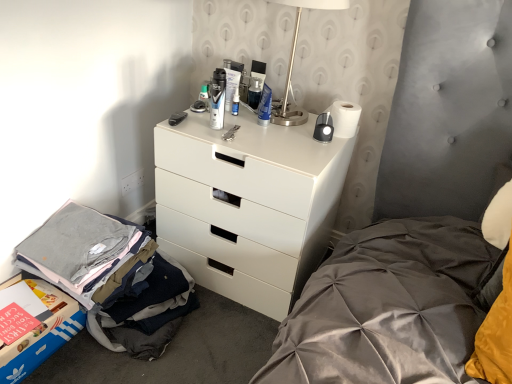
This screenshot has width=512, height=384. Describe the element at coordinates (345, 118) in the screenshot. I see `white matte toilet paper at upper right` at that location.

What do you see at coordinates (111, 277) in the screenshot? I see `gray cotton t-shirts at lower left` at bounding box center [111, 277].

I want to click on gray cotton t-shirts at lower left, so click(111, 277).

What is the approximate height of white plastic outlet at lower left?

white plastic outlet at lower left is 4.12 inches in height.

The width and height of the screenshot is (512, 384). Find the location of `matte plastic tube at upper center, marked as the 3th toiletry in a right-to-left arrangement`. matte plastic tube at upper center, marked as the 3th toiletry in a right-to-left arrangement is located at coordinates (231, 80).

The width and height of the screenshot is (512, 384). I want to click on blue plastic tube at center, which is the 1th toiletry from right to left, so click(x=265, y=106).

Describe the element at coordinates (265, 106) in the screenshot. I see `blue plastic tube at center, which is the 1th toiletry from right to left` at that location.

Find the location of a particular element. This screenshot has width=512, height=384. white matte toilet paper at upper right is located at coordinates (345, 118).

Which point is more distant from viewer, [73,302] or [166,251]?

The point [166,251] is behind.

Consider the image. Is blue cardboard storage box at lower left far from white matte chest of drawers at center?

They are positioned close to each other.

From a real-world perspective, is blue cardboard storage box at lower left positioned under white matte chest of drawers at center based on gravity?

Yes, from a real-world perspective, blue cardboard storage box at lower left is below white matte chest of drawers at center.

How distant is blue cardboard storage box at lower left from white matte chest of drawers at center?

blue cardboard storage box at lower left and white matte chest of drawers at center are 63.33 centimeters apart.

What's the angular difference between blue cardboard storage box at lower left and translucent plastic bottle at upper center, the 1th toiletry from the left,'s facing directions?

blue cardboard storage box at lower left and translucent plastic bottle at upper center, the 1th toiletry from the left, are facing 88 degrees away from each other.

Which object is further away from the camera taking this photo, blue cardboard storage box at lower left or translucent plastic bottle at upper center, the 1th toiletry from the left?

translucent plastic bottle at upper center, the 1th toiletry from the left, is behind.

Image resolution: width=512 pixels, height=384 pixels. In the image, there is a translucent plastic bottle at upper center, marked as the fifth toiletry in a right-to-left arrangement. Identify the location of storage box below it (from a real-world perspective). (33, 325).

Between matte plastic tube at upper center, which ranks as the third toiletry in left-to-right order, and white matte toilet paper at upper right, which one appears on the right side from the viewer's perspective?

white matte toilet paper at upper right.

How many degrees apart are the facing directions of matte plastic tube at upper center, which ranks as the third toiletry in left-to-right order, and white matte toilet paper at upper right?

There is a 0.000739-degree angle between the facing directions of matte plastic tube at upper center, which ranks as the third toiletry in left-to-right order, and white matte toilet paper at upper right.

Is point (227, 63) positioned in front of point (348, 108)?

No, (227, 63) is behind (348, 108).

Can you confirm if matte plastic tube at upper center, which ranks as the third toiletry in left-to-right order, is smaller than white matte toilet paper at upper right?

Yes.

Looking at the image, does gray cotton t-shirts at lower left seem bigger or smaller compared to blue plastic tube at center, positioned as the 5th toiletry in left-to-right order?

Clearly, gray cotton t-shirts at lower left is larger in size than blue plastic tube at center, positioned as the 5th toiletry in left-to-right order.

From the image's perspective, count 1st toiletrys upward from the gray cotton t-shirts at lower left and point to it. Please provide its 2D coordinates.

[(265, 106)]

Is gray cotton t-shirts at lower left at the right side of blue plastic tube at center, which is the 1th toiletry from right to left?

In fact, gray cotton t-shirts at lower left is to the left of blue plastic tube at center, which is the 1th toiletry from right to left.

Would you say gray cotton t-shirts at lower left contains blue plastic tube at center, positioned as the 5th toiletry in left-to-right order?

No, blue plastic tube at center, positioned as the 5th toiletry in left-to-right order, is not inside gray cotton t-shirts at lower left.

Is the surface of matte black shaving cream can at center, marked as the second toiletry in a left-to-right arrangement, in direct contact with gray cotton t-shirts at lower left?

No, matte black shaving cream can at center, marked as the second toiletry in a left-to-right arrangement, is not beside gray cotton t-shirts at lower left.

From the picture: Can you confirm if matte black shaving cream can at center, marked as the second toiletry in a left-to-right arrangement, is wider than gray cotton t-shirts at lower left?

No, matte black shaving cream can at center, marked as the second toiletry in a left-to-right arrangement, is not wider than gray cotton t-shirts at lower left.

Consider the image. From the image's perspective, who appears lower, matte black shaving cream can at center, acting as the 4th toiletry starting from the right, or gray cotton t-shirts at lower left?

gray cotton t-shirts at lower left appears lower in the image.

Is point (214, 110) closer or farther from the camera than point (163, 268)?

Clearly, point (214, 110) is more distant from the camera than point (163, 268).

Consider the image. Considering the relative sizes of matte plastic tube at upper center, which ranks as the third toiletry in left-to-right order, and satin silver table lamp at upper right in the image provided, is matte plastic tube at upper center, which ranks as the third toiletry in left-to-right order, smaller than satin silver table lamp at upper right?

Yes, matte plastic tube at upper center, which ranks as the third toiletry in left-to-right order, is smaller than satin silver table lamp at upper right.

From a real-world perspective, is matte plastic tube at upper center, marked as the 3th toiletry in a right-to-left arrangement, located higher than satin silver table lamp at upper right?

No, from a real-world perspective, matte plastic tube at upper center, marked as the 3th toiletry in a right-to-left arrangement, is not over satin silver table lamp at upper right

Image resolution: width=512 pixels, height=384 pixels. I want to click on toiletry that is the 3rd one when counting leftward from the satin silver table lamp at upper right, so click(x=231, y=80).

Can satin silver table lamp at upper right be found inside matte plastic tube at upper center, marked as the 3th toiletry in a right-to-left arrangement?

No, satin silver table lamp at upper right is not surrounded by matte plastic tube at upper center, marked as the 3th toiletry in a right-to-left arrangement.

From the image's perspective, who appears lower, translucent plastic bottle at upper center, marked as the fifth toiletry in a right-to-left arrangement, or satin silver table lamp at upper right?

From the image's view, translucent plastic bottle at upper center, marked as the fifth toiletry in a right-to-left arrangement, is below.

In terms of size, does translucent plastic bottle at upper center, marked as the fifth toiletry in a right-to-left arrangement, appear bigger or smaller than satin silver table lamp at upper right?

translucent plastic bottle at upper center, marked as the fifth toiletry in a right-to-left arrangement, is smaller than satin silver table lamp at upper right.

How many degrees apart are the facing directions of translucent plastic bottle at upper center, the 1th toiletry from the left, and satin silver table lamp at upper right?

translucent plastic bottle at upper center, the 1th toiletry from the left, and satin silver table lamp at upper right are facing 0.987 degrees away from each other.

This screenshot has width=512, height=384. I want to click on table lamp that is in front of the translucent plastic bottle at upper center, marked as the fifth toiletry in a right-to-left arrangement, so click(294, 56).

Identify the location of chest of drawers behind the blue cardboard storage box at lower left. (248, 205).

The width and height of the screenshot is (512, 384). Identify the location of storage box below the translucent plastic bottle at upper center, marked as the fifth toiletry in a right-to-left arrangement (from a real-world perspective). (33, 325).

Estimate the real-world distances between objects in this image. Which object is further from satin silver table lamp at upper right, white matte toilet paper at upper right or white plastic outlet at lower left?

white plastic outlet at lower left lies further to satin silver table lamp at upper right than the other object.

Estimate the real-world distances between objects in this image. Which object is further from white matte chest of drawers at center, blue plastic tube at center, which is the 1th toiletry from right to left, or blue cardboard storage box at lower left?

blue cardboard storage box at lower left is positioned further to the anchor white matte chest of drawers at center.

Which object lies further to the anchor point blue glossy bottle at center, the second toiletry viewed from the right, blue plastic tube at center, which is the 1th toiletry from right to left, or matte black shaving cream can at center, marked as the second toiletry in a left-to-right arrangement?

The object further to blue glossy bottle at center, the second toiletry viewed from the right, is blue plastic tube at center, which is the 1th toiletry from right to left.

Estimate the real-world distances between objects in this image. Which object is further from blue cardboard storage box at lower left, white plastic outlet at lower left or matte black shaving cream can at center, marked as the second toiletry in a left-to-right arrangement?

matte black shaving cream can at center, marked as the second toiletry in a left-to-right arrangement, lies further to blue cardboard storage box at lower left than the other object.

Considering their positions, is translucent plastic bottle at upper center, marked as the fifth toiletry in a right-to-left arrangement, positioned closer to satin silver table lamp at upper right than matte black shaving cream can at center, marked as the second toiletry in a left-to-right arrangement?

matte black shaving cream can at center, marked as the second toiletry in a left-to-right arrangement, is closer to satin silver table lamp at upper right.

From the image, which object appears to be nearer to white matte chest of drawers at center, white matte toilet paper at upper right or white plastic outlet at lower left?

white matte toilet paper at upper right is closer to white matte chest of drawers at center.

Based on their spatial positions, is blue plastic tube at center, positioned as the 5th toiletry in left-to-right order, or white plastic outlet at lower left closer to white matte toilet paper at upper right?

Among the two, blue plastic tube at center, positioned as the 5th toiletry in left-to-right order, is located nearer to white matte toilet paper at upper right.

Based on their spatial positions, is white matte chest of drawers at center or matte plastic tube at upper center, marked as the 3th toiletry in a right-to-left arrangement, further from blue cardboard storage box at lower left?

matte plastic tube at upper center, marked as the 3th toiletry in a right-to-left arrangement, is further to blue cardboard storage box at lower left.

At what (x,y) coordinates should I click in order to perform the action: click on clothing between blue glossy bottle at center, the second toiletry viewed from the right, and blue cardboard storage box at lower left vertically. Please return your answer as a coordinate pair (x, y). This screenshot has height=384, width=512. Looking at the image, I should click on (111, 277).

This screenshot has height=384, width=512. Identify the location of clothing between matte plastic tube at upper center, which ranks as the third toiletry in left-to-right order, and blue cardboard storage box at lower left vertically. (111, 277).

In order to click on chest of drawers between white plastic outlet at lower left and satin silver table lamp at upper right from left to right in this screenshot , I will do `click(248, 205)`.

Where is `chest of drawers between white plastic outlet at lower left and blue plastic tube at center, positioned as the 5th toiletry in left-to-right order`? The image size is (512, 384). chest of drawers between white plastic outlet at lower left and blue plastic tube at center, positioned as the 5th toiletry in left-to-right order is located at coordinates (248, 205).